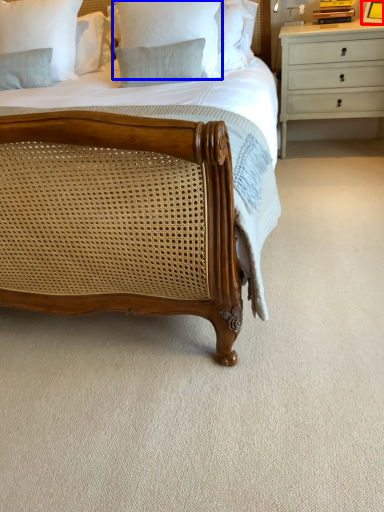
Question: Which object appears closest to the camera in this image, picture frame (highlighted by a red box) or pillow (highlighted by a blue box)?

Choices:
 (A) picture frame
 (B) pillow

Answer: (B)